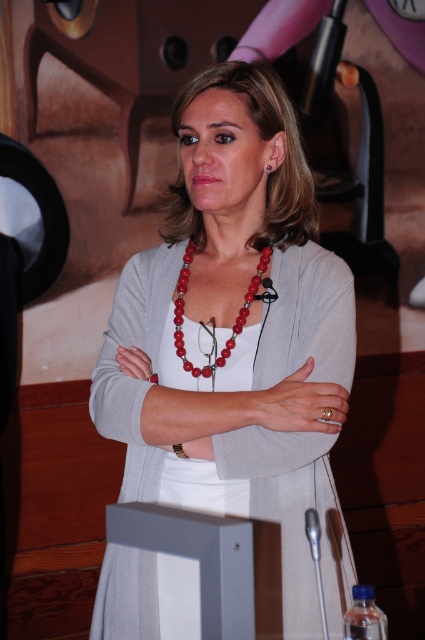
Between point (204, 163) and point (271, 172), which one is positioned behind?

Point (271, 172)

Is matte gray cardigan at center positioned at the back of red glass earring at center?

No, it is not.

Is point (189, 364) positioned behind point (269, 172)?

That is False.

Locate an element on the screen. The width and height of the screenshot is (425, 640). matte gray cardigan at center is located at coordinates (240, 337).

In order to click on matte gray cardigan at center in this screenshot , I will do `click(240, 337)`.

Who is positioned more to the left, matte gray cardigan at center or red beaded necklace at center?

From the viewer's perspective, red beaded necklace at center appears more on the left side.

Find the location of a particular element. The image size is (425, 640). matte gray cardigan at center is located at coordinates (240, 337).

Who is taller, red beaded necklace at center or red glass earring at center?

red beaded necklace at center

Is point (184, 260) more distant than point (265, 170)?

Yes, it is behind point (265, 170).

What are the coordinates of `red beaded necklace at center` in the screenshot? It's located at (212, 317).